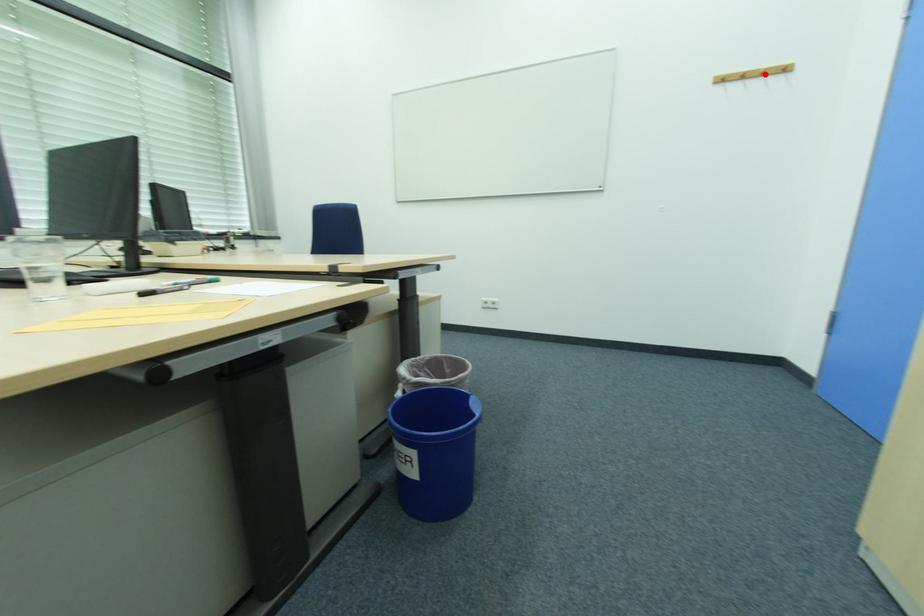
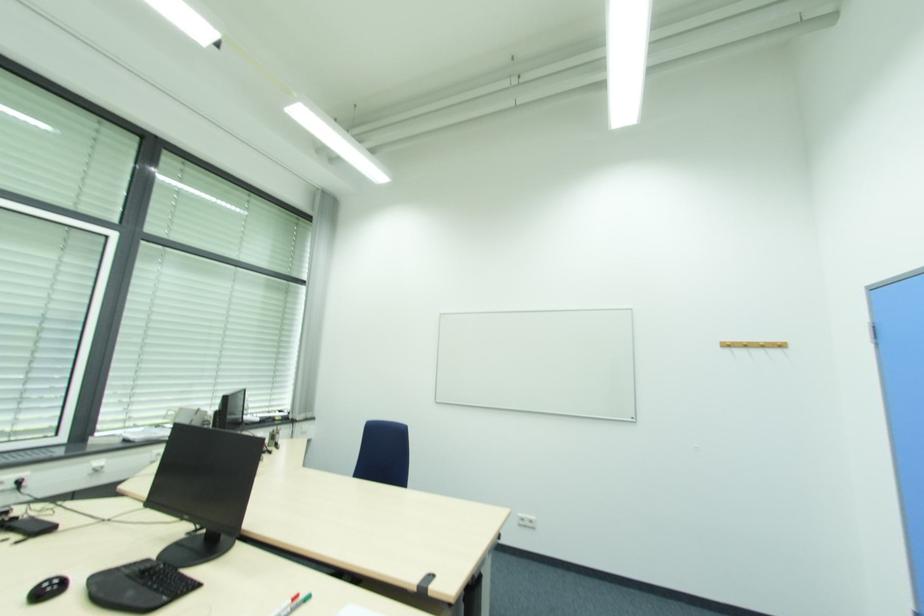
Locate, in the second image, the point that corresponds to the highlighted location in the first image.

(764, 346)